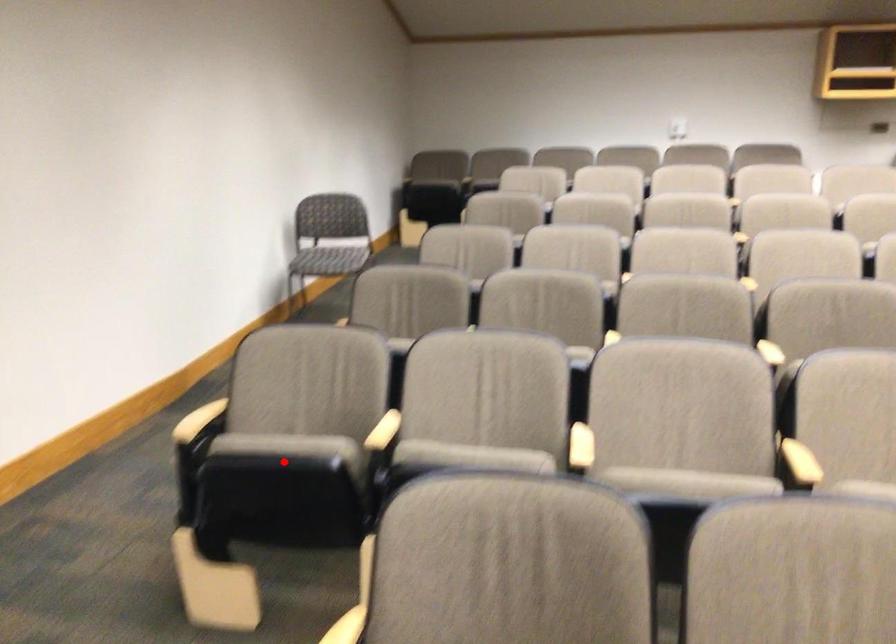
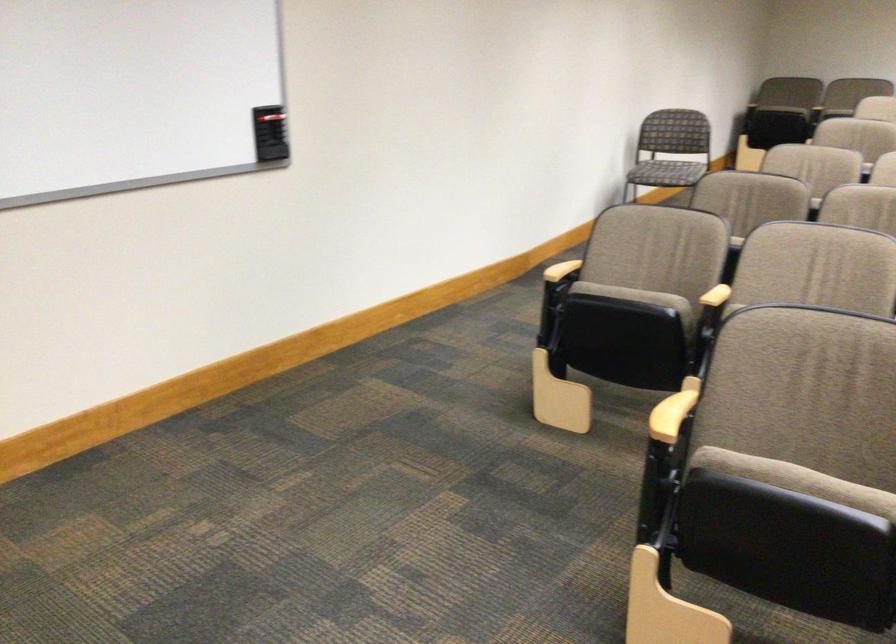
Question: I am providing you with two images of the same scene from different viewpoints. In image1, a red point is highlighted. Considering the same 3D point in image2, which of the following is correct?

Choices:
 (A) It is closer
 (B) It is farther

Answer: (B)